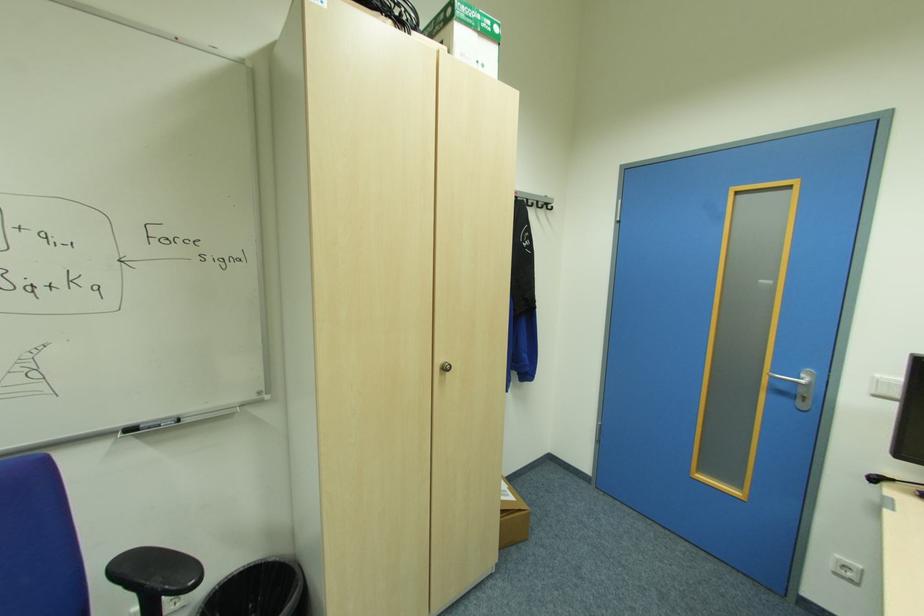
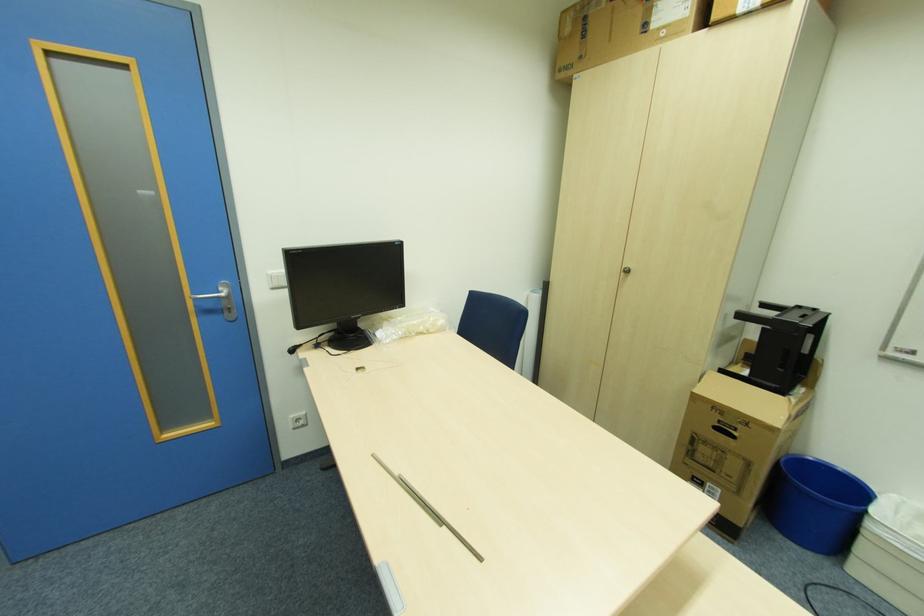
Where in the second image is the point corresponding to pixel 806 400 from the first image?

(234, 310)